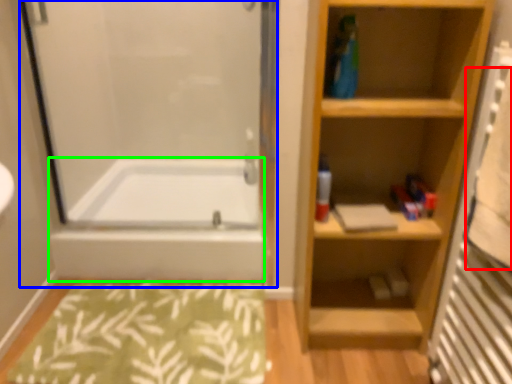
Question: Which is farther away from bath towel (highlighted by a red box)? screen door (highlighted by a blue box) or bathtub (highlighted by a green box)?

Choices:
 (A) screen door
 (B) bathtub

Answer: (A)